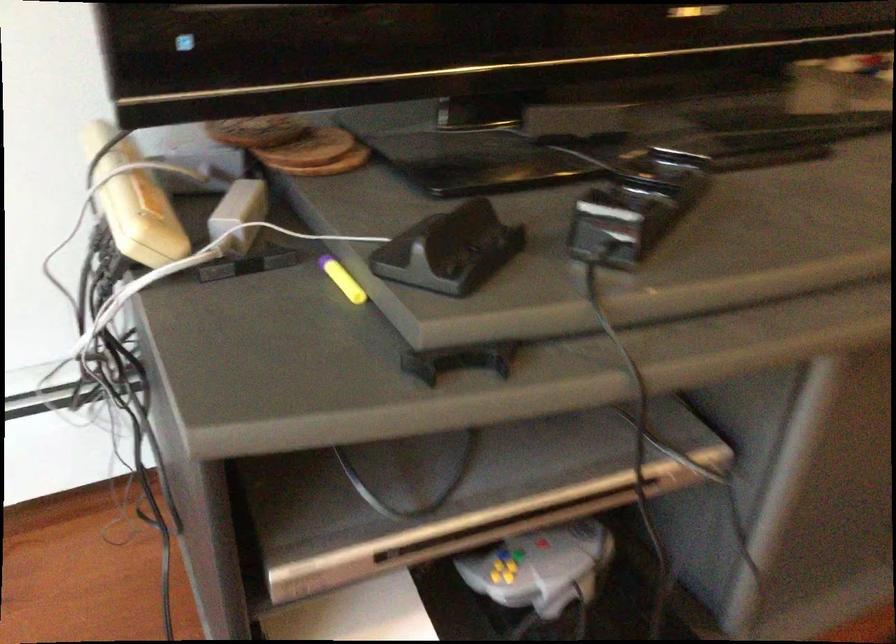
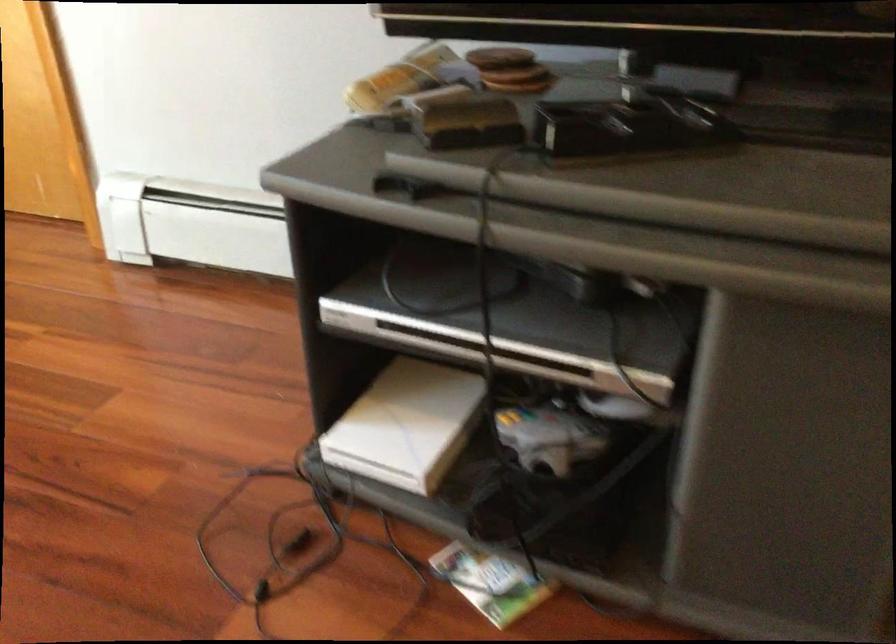
Find the pixel in the second image that matches (x=659, y=194) in the first image.

(627, 126)